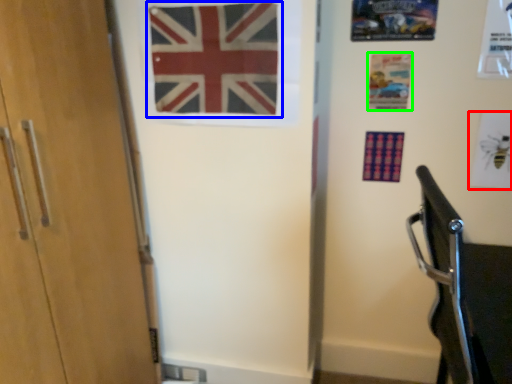
Question: Which is farther away from postcard (highlighted by a red box)? flag (highlighted by a blue box) or postcard (highlighted by a green box)?

Choices:
 (A) flag
 (B) postcard

Answer: (A)